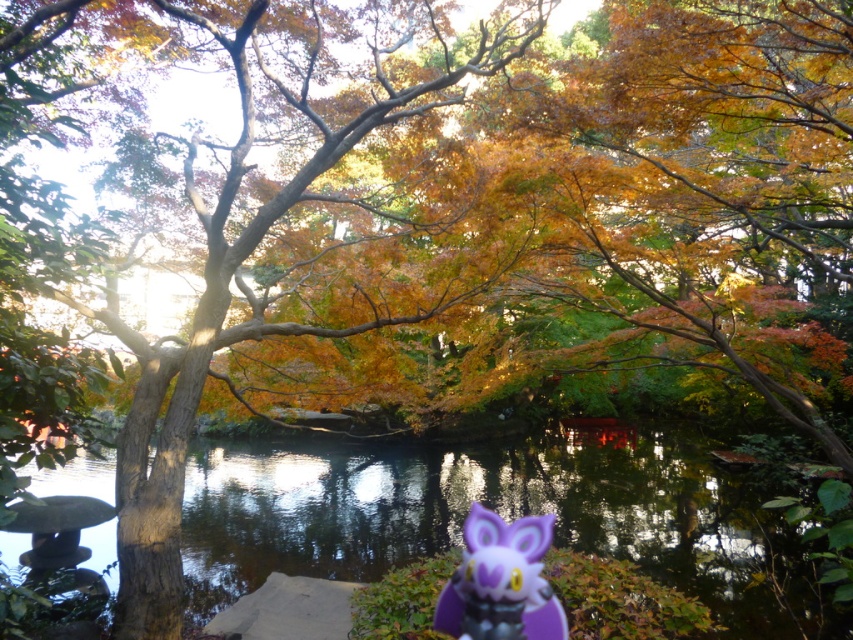
Question: Is the position of transparent water at center more distant than that of purple matte plush toy at lower center?

Choices:
 (A) yes
 (B) no

Answer: (A)

Question: Which point is closer to the camera?

Choices:
 (A) (474, 616)
 (B) (199, 529)

Answer: (A)

Question: Which of the following is the farthest from the observer?

Choices:
 (A) (714, 611)
 (B) (523, 560)

Answer: (A)

Question: Is the position of transparent water at center more distant than that of purple matte plush toy at lower center?

Choices:
 (A) no
 (B) yes

Answer: (B)

Question: Is transparent water at center positioned behind purple matte plush toy at lower center?

Choices:
 (A) yes
 (B) no

Answer: (A)